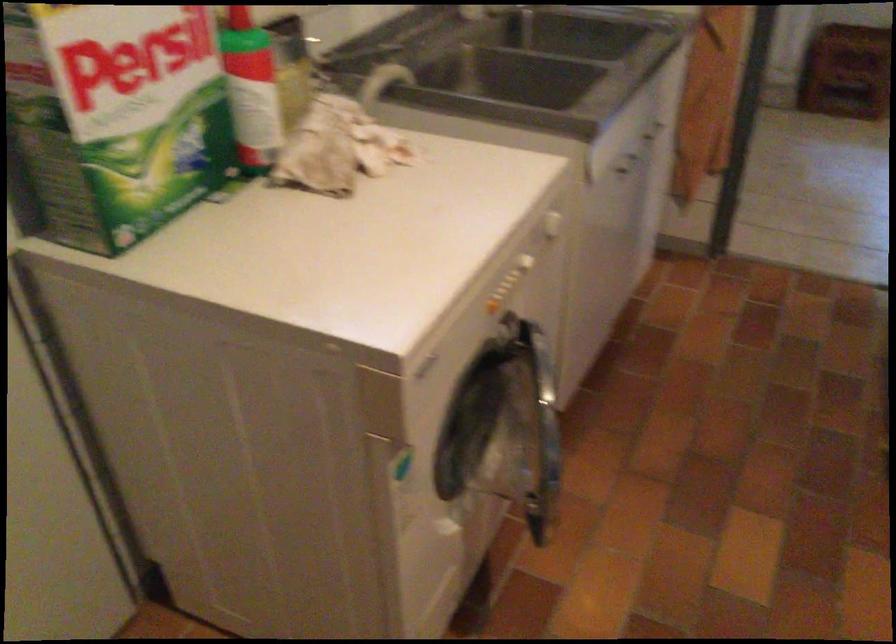
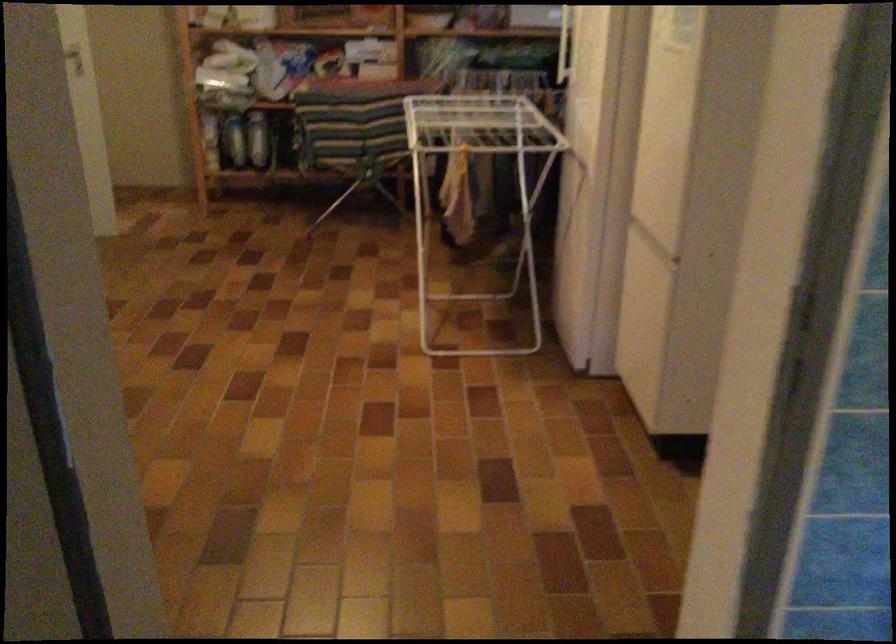
How did the camera likely rotate?

The camera's rotation is toward right-down.